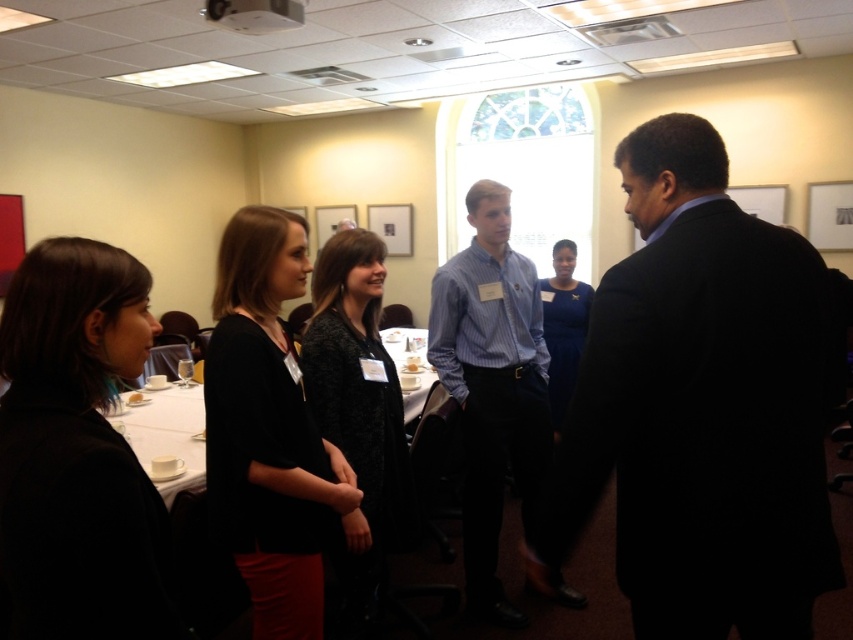
Identify the location of dark suit at right. The width and height of the screenshot is (853, 640). (700, 408).

Does dark suit at right have a larger size compared to black matte dress at center?

Yes.

This screenshot has height=640, width=853. Find the location of `dark suit at right`. dark suit at right is located at coordinates (700, 408).

Between black matte jacket at lower left and black matte dress at center, which one is positioned higher?

black matte jacket at lower left is above.

Which of these two, black matte jacket at lower left or black matte dress at center, stands taller?

With more height is black matte dress at center.

Locate an element on the screen. The width and height of the screenshot is (853, 640). black matte jacket at lower left is located at coordinates (77, 452).

Does dark suit at right lie in front of blue satin dress at center?

Yes, dark suit at right is closer to the viewer.

Looking at this image, is dark suit at right bigger than blue satin dress at center?

Correct, dark suit at right is larger in size than blue satin dress at center.

Who is more distant from viewer, (660,579) or (560,275)?

The point (560,275) is more distant.

Find the location of a particular element. dark suit at right is located at coordinates (x=700, y=408).